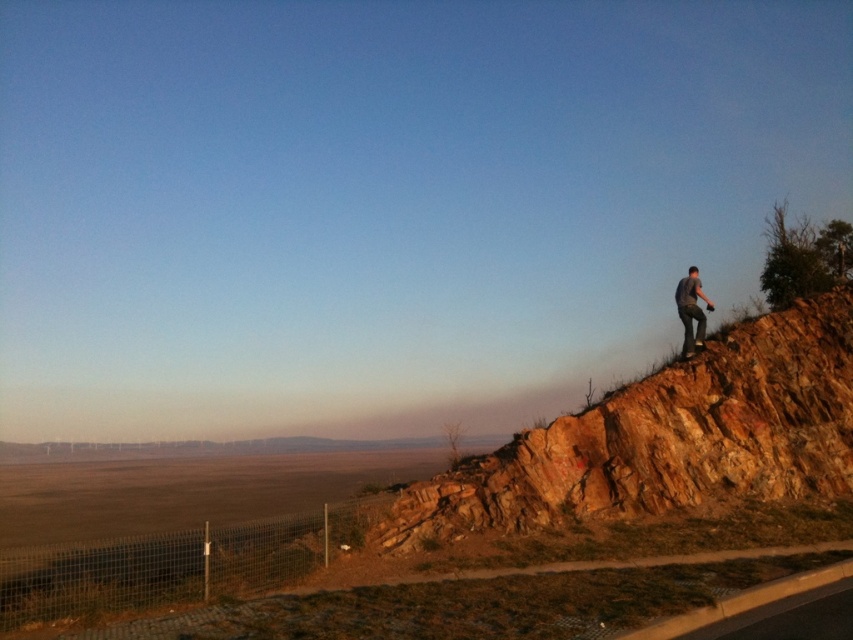
Based on the coordinates provided, which object in the scene is located at point [666,438]?

The point [666,438] indicates the rustic stone hillside at upper right.